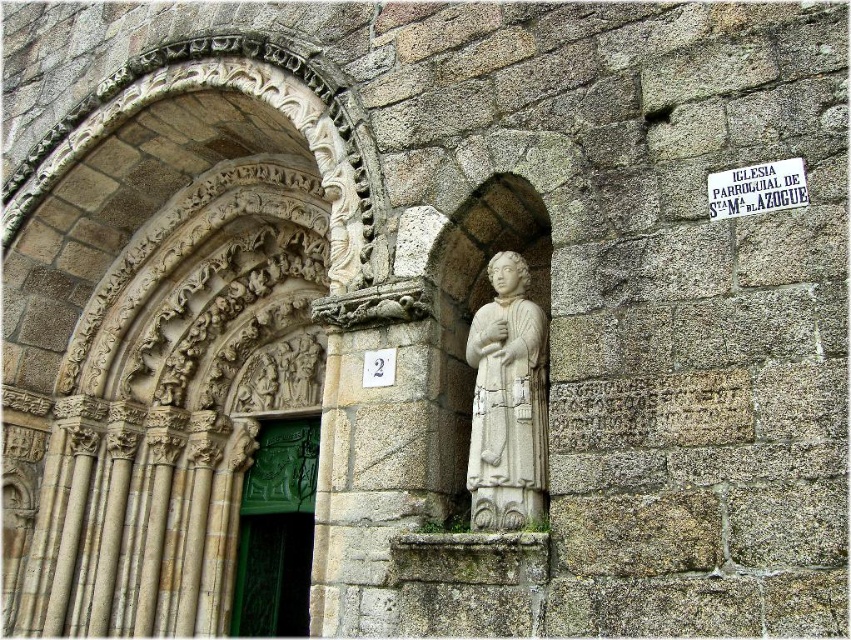
Who is higher up, white stone statue at center or white paper sign at upper center?

Positioned higher is white paper sign at upper center.

The height and width of the screenshot is (640, 851). What do you see at coordinates (507, 403) in the screenshot? I see `white stone statue at center` at bounding box center [507, 403].

At what (x,y) coordinates should I click in order to perform the action: click on white stone statue at center. Please return your answer as a coordinate pair (x, y). The image size is (851, 640). Looking at the image, I should click on (507, 403).

I want to click on white stone statue at center, so click(507, 403).

Is white stone statue at center smaller than green carved wood door at center?

Yes, white stone statue at center is smaller than green carved wood door at center.

The width and height of the screenshot is (851, 640). What do you see at coordinates (507, 403) in the screenshot?
I see `white stone statue at center` at bounding box center [507, 403].

Measure the distance between white stone statue at center and camera.

white stone statue at center and camera are 26.46 meters apart from each other.

Locate an element on the screen. white stone statue at center is located at coordinates (507, 403).

Based on the photo, between green carved wood door at center and white paper sign at upper center, which one has less height?

Standing shorter between the two is white paper sign at upper center.

Can you confirm if green carved wood door at center is thinner than white paper sign at upper center?

No, green carved wood door at center is not thinner than white paper sign at upper center.

Is point (300, 532) farther from camera compared to point (747, 173)?

Yes, it is behind point (747, 173).

What are the coordinates of `green carved wood door at center` in the screenshot? It's located at (276, 531).